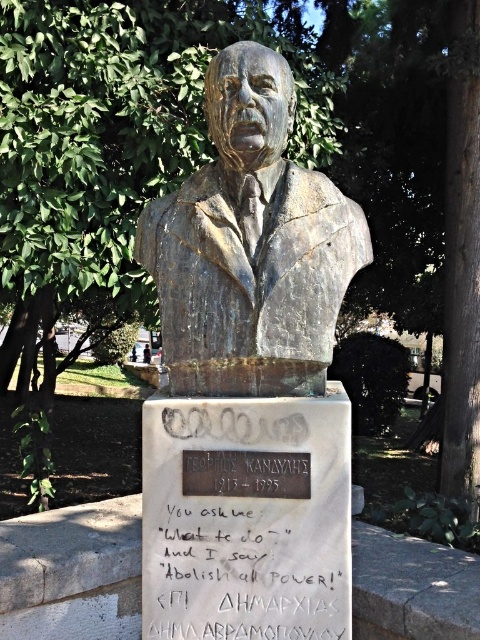
Question: Is bronze bust at center smaller than bronze plaque at center?

Choices:
 (A) no
 (B) yes

Answer: (A)

Question: Which of the following is the closest to the observer?

Choices:
 (A) coord(265,500)
 (B) coord(325,314)
 (C) coord(203,454)

Answer: (B)

Question: Can you confirm if bronze bust at center is positioned above handwritten text at center?

Choices:
 (A) no
 (B) yes

Answer: (B)

Question: Which of the following is the farthest from the observer?

Choices:
 (A) bronze plaque at center
 (B) handwritten text at center
 (C) bronze bust at center

Answer: (A)

Question: Can you confirm if handwritten text at center is positioned above bronze plaque at center?

Choices:
 (A) yes
 (B) no

Answer: (B)

Question: Which of the following is the closest to the observer?

Choices:
 (A) (231, 584)
 (B) (158, 212)
 (C) (276, 490)

Answer: (C)